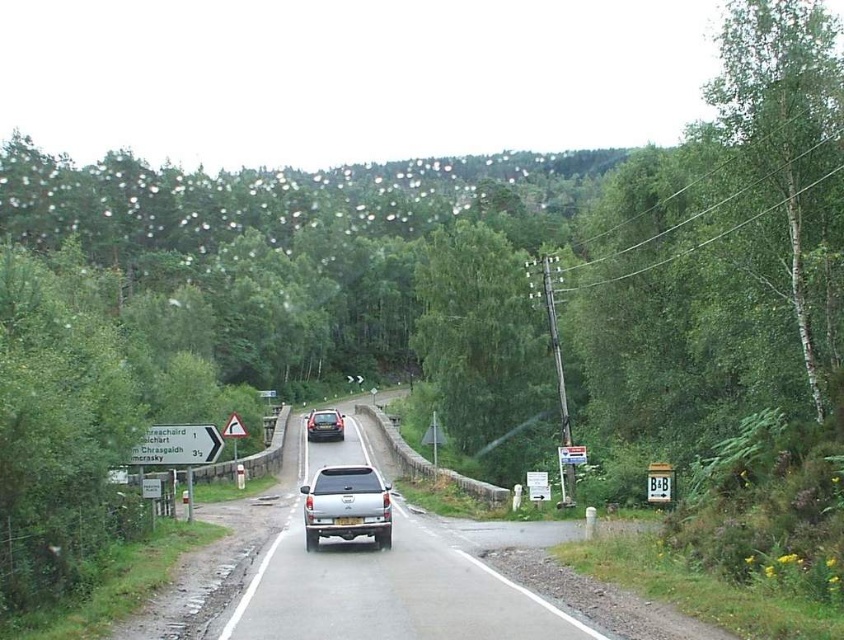
Question: Is silver metallic suv at center to the right of satin silver suv at center from the viewer's perspective?

Choices:
 (A) yes
 (B) no

Answer: (A)

Question: Which is nearer to the silver metallic suv at center?

Choices:
 (A) silver metallic truck at center
 (B) satin silver suv at center
 (C) black plastic triangle at upper center

Answer: (A)

Question: Considering the relative positions of green leafy tree at center and black plastic triangle at upper center in the image provided, where is green leafy tree at center located with respect to black plastic triangle at upper center?

Choices:
 (A) below
 (B) above

Answer: (B)

Question: Is white plastic sign at left thinner than black plastic triangle at upper center?

Choices:
 (A) no
 (B) yes

Answer: (B)

Question: Which object is the closest to the black plastic triangle at upper center?

Choices:
 (A) green leafy tree at center
 (B) gold metallic license plate at center
 (C) white bark tree at right
 (D) silver metallic truck at center

Answer: (D)

Question: Based on their relative distances, which object is nearer to the gold metallic license plate at center?

Choices:
 (A) white plastic sign at left
 (B) silver metallic suv at center
 (C) green leafy tree at center

Answer: (B)